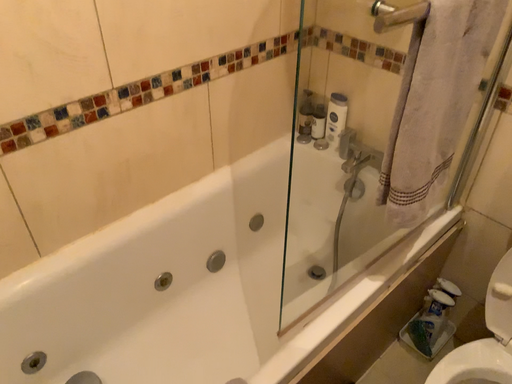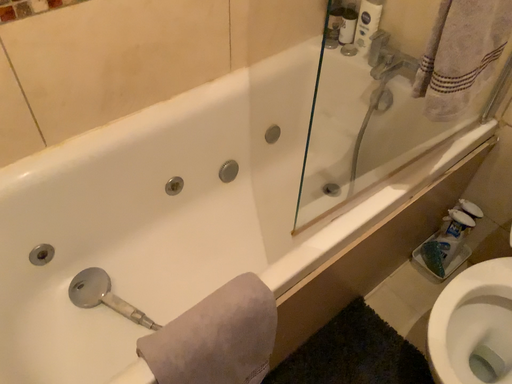
Question: Which way did the camera rotate in the video?

Choices:
 (A) rotated downward
 (B) rotated upward

Answer: (A)